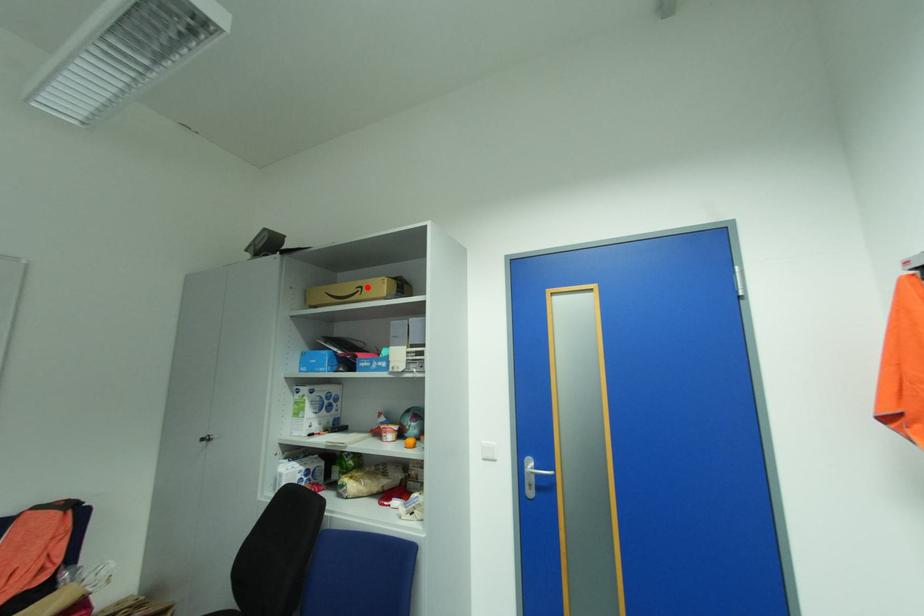
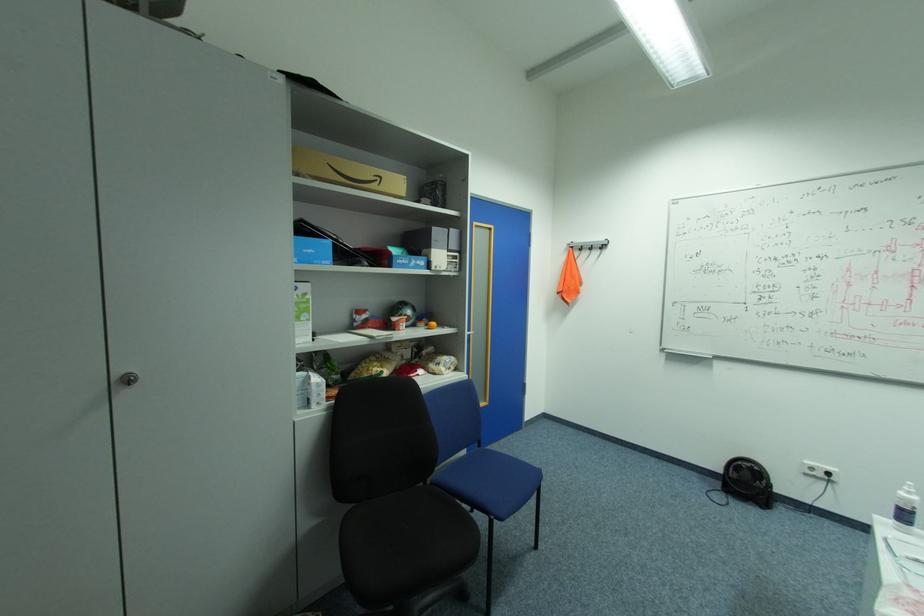
In the second image, find the point that corresponds to the highlighted location in the first image.

(386, 177)